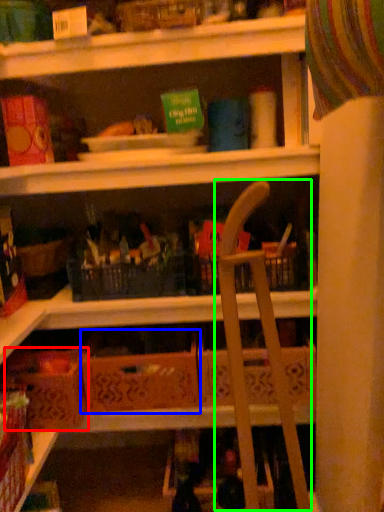
Question: Estimate the real-world distances between objects in this image. Which object is farther from cardboard box (highlighted by a red box), cardboard box (highlighted by a blue box) or folding chair (highlighted by a green box)?

Choices:
 (A) cardboard box
 (B) folding chair

Answer: (B)